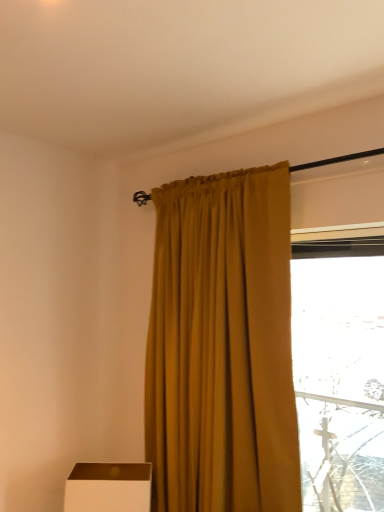
Question: Should I look upward or downward to see white matte box at lower left?

Choices:
 (A) down
 (B) up

Answer: (A)

Question: Is white matte box at lower left closer to camera compared to mustard fabric curtain at center?

Choices:
 (A) no
 (B) yes

Answer: (A)

Question: From the image's perspective, is white matte box at lower left above mustard fabric curtain at center?

Choices:
 (A) no
 (B) yes

Answer: (A)

Question: Could you tell me if white matte box at lower left is turned towards mustard fabric curtain at center?

Choices:
 (A) no
 (B) yes

Answer: (A)

Question: Is white matte box at lower left taller than mustard fabric curtain at center?

Choices:
 (A) yes
 (B) no

Answer: (B)

Question: Is white matte box at lower left oriented away from mustard fabric curtain at center?

Choices:
 (A) no
 (B) yes

Answer: (A)

Question: Considering the relative sizes of white matte box at lower left and mustard fabric curtain at center in the image provided, is white matte box at lower left bigger than mustard fabric curtain at center?

Choices:
 (A) no
 (B) yes

Answer: (A)

Question: Are mustard fabric curtain at center and white matte box at lower left beside each other?

Choices:
 (A) yes
 (B) no

Answer: (B)

Question: Considering the relative sizes of mustard fabric curtain at center and white matte box at lower left in the image provided, is mustard fabric curtain at center wider than white matte box at lower left?

Choices:
 (A) yes
 (B) no

Answer: (B)

Question: From a real-world perspective, is mustard fabric curtain at center physically below white matte box at lower left?

Choices:
 (A) yes
 (B) no

Answer: (B)

Question: From the image's perspective, is mustard fabric curtain at center located above white matte box at lower left?

Choices:
 (A) no
 (B) yes

Answer: (B)

Question: Is mustard fabric curtain at center shorter than white matte box at lower left?

Choices:
 (A) yes
 (B) no

Answer: (B)

Question: From a real-world perspective, is mustard fabric curtain at center located higher than white matte box at lower left?

Choices:
 (A) no
 (B) yes

Answer: (B)

Question: Considering the positions of point (188, 246) and point (129, 501), is point (188, 246) closer or farther from the camera than point (129, 501)?

Choices:
 (A) farther
 (B) closer

Answer: (A)